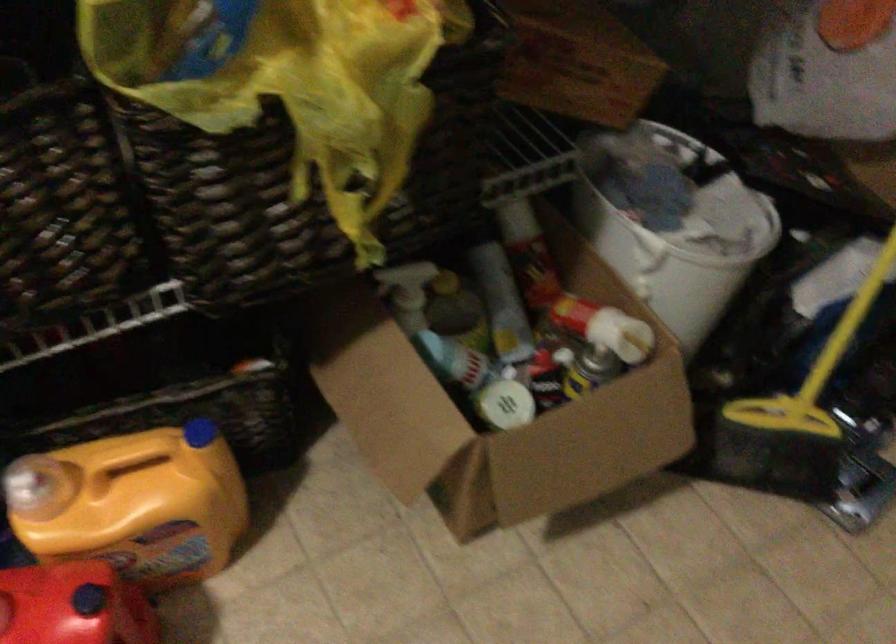
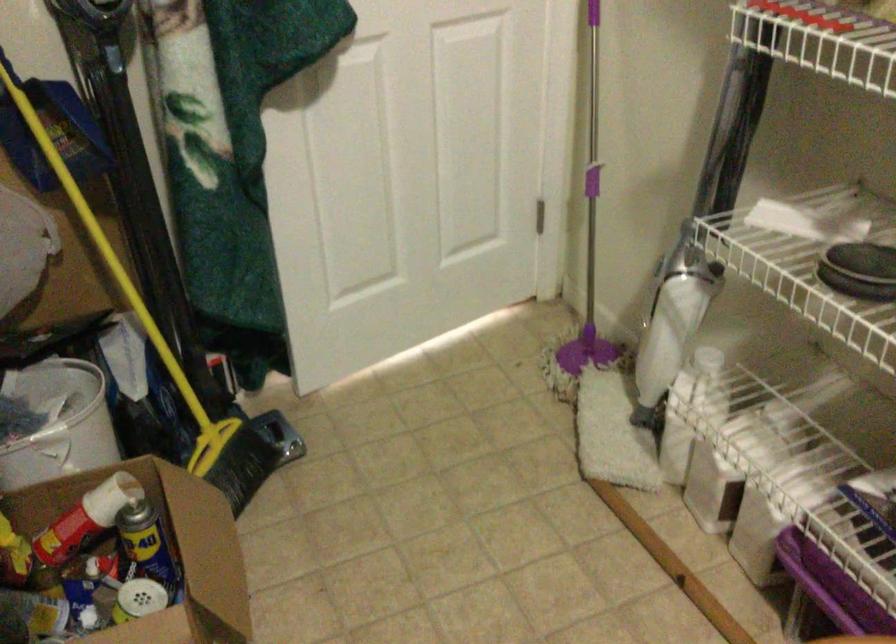
In the second image, find the point that corresponds to (x=569, y=386) in the first image.

(147, 547)